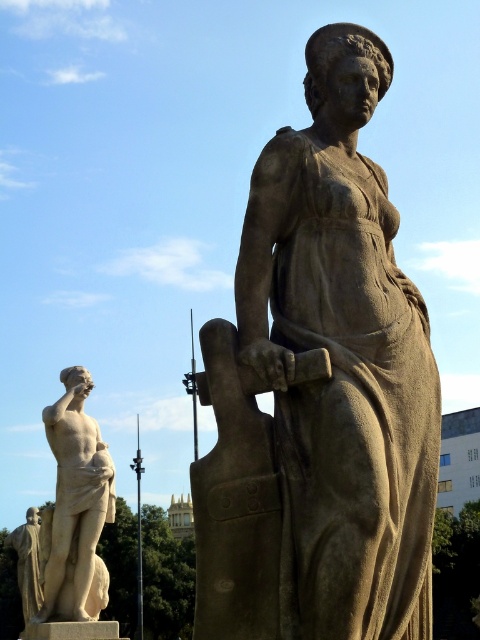
In the scene shown: Who is higher up, matte stone statue at center or white marble statue at left?

matte stone statue at center is higher up.

Who is shorter, matte stone statue at center or white marble statue at left?

With less height is matte stone statue at center.

Find the location of a particular element. This screenshot has width=480, height=640. matte stone statue at center is located at coordinates (320, 390).